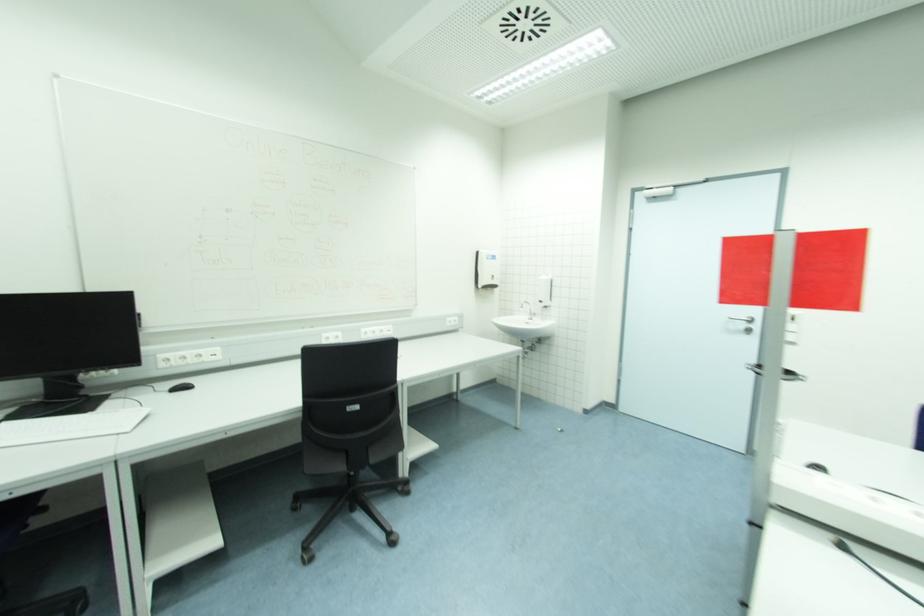
The width and height of the screenshot is (924, 616). I want to click on dispenser push lever, so click(543, 291).